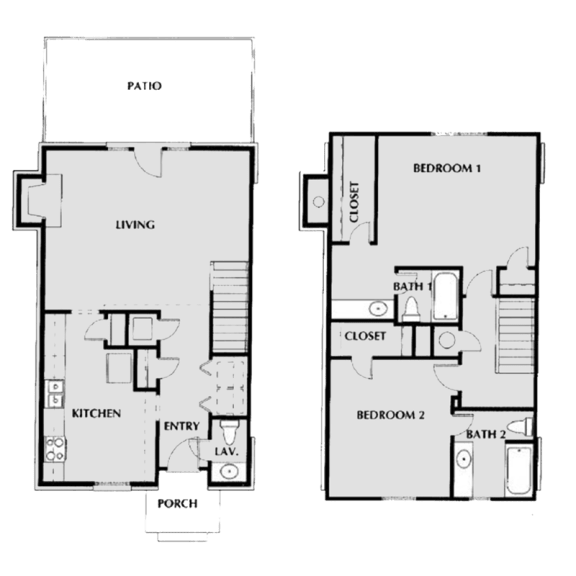
Identify the location of fridge. (118, 367).